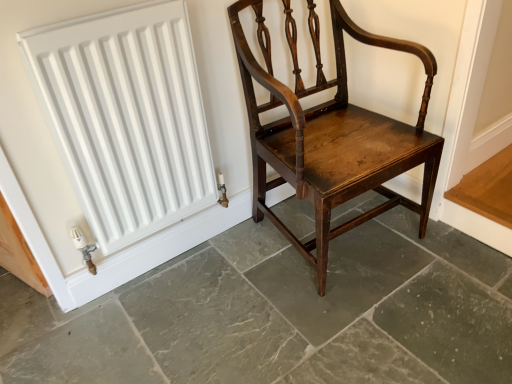
Question: From the image's perspective, relative to dark brown wood chair at center, is white matte radiator at upper left above or below?

Choices:
 (A) above
 (B) below

Answer: (A)

Question: From a real-world perspective, is white matte radiator at upper left physically located above or below dark brown wood chair at center?

Choices:
 (A) above
 (B) below

Answer: (A)

Question: Which of these objects is positioned closest to the white matte radiator at upper left?

Choices:
 (A) shiny dark wood chair at center
 (B) dark brown wood chair at center

Answer: (A)

Question: Which of these objects is positioned farthest from the dark brown wood chair at center?

Choices:
 (A) shiny dark wood chair at center
 (B) white matte radiator at upper left

Answer: (B)